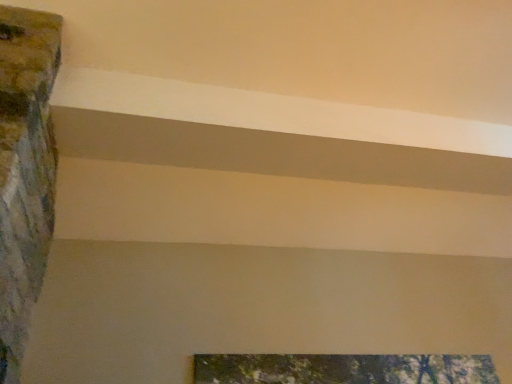
What are the coordinates of `free space above textured green oil painting at lower center (from a real-world perspective)` in the screenshot? It's located at (346, 347).